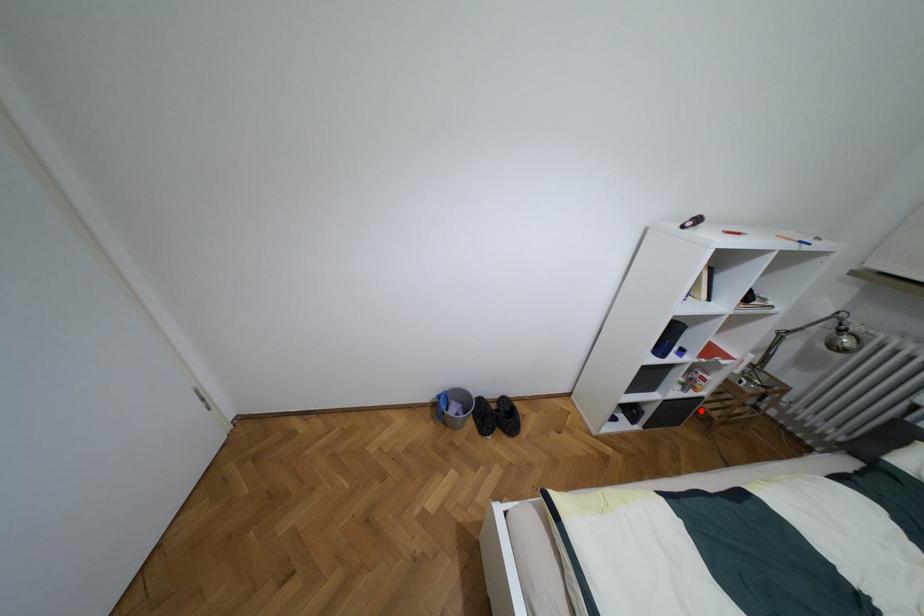
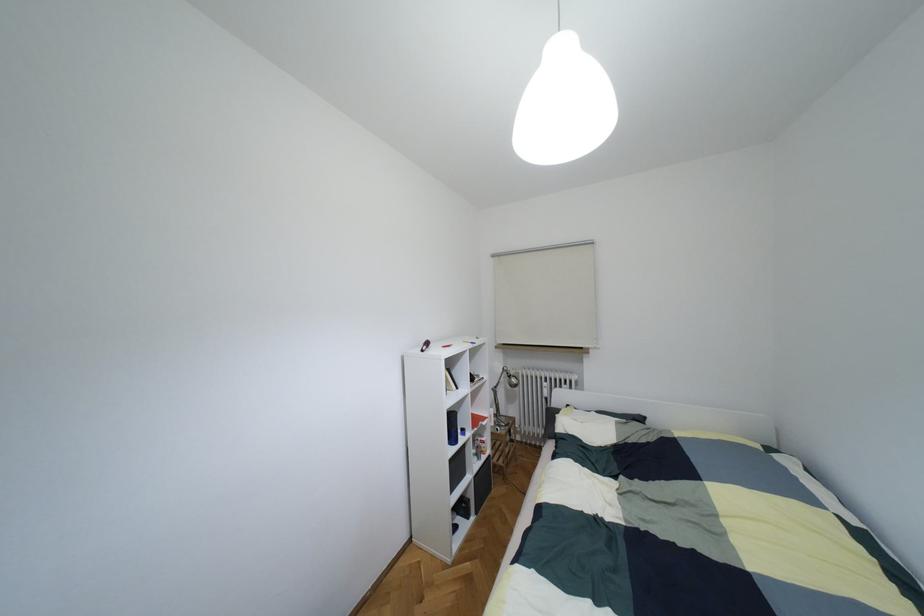
Question: A red point is marked in image1. In image2, is the corresponding 3D point closer to the camera or farther? Reply with the corresponding letter.

Choices:
 (A) The corresponding 3D point is closer.
 (B) The corresponding 3D point is farther.

Answer: (B)